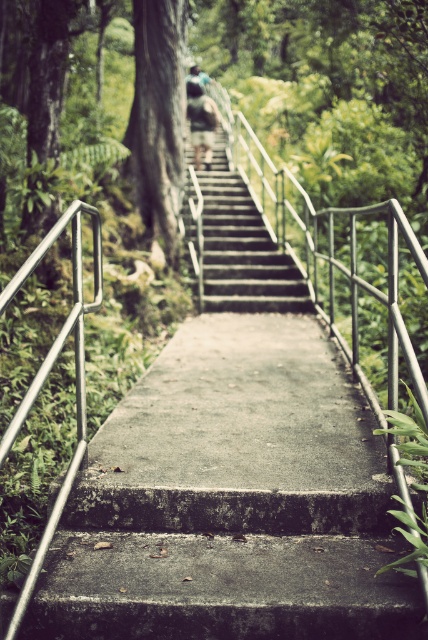
Question: Estimate the real-world distances between objects in this image. Which object is closer to the silver metallic handrail at left?

Choices:
 (A) green rough bark tree at center
 (B) green fabric shirt at upper center

Answer: (A)

Question: Which object is the closest to the silver metallic handrail at left?

Choices:
 (A) green rough bark tree at center
 (B) concrete/steps at center

Answer: (B)

Question: Does green rough bark tree at center lie in front of silver metallic handrail at left?

Choices:
 (A) yes
 (B) no

Answer: (B)

Question: Is green rough bark tree at center positioned before green fabric shirt at upper center?

Choices:
 (A) no
 (B) yes

Answer: (B)

Question: Is concrete/steps at center thinner than green fabric shirt at upper center?

Choices:
 (A) yes
 (B) no

Answer: (B)

Question: Which object is positioned farthest from the concrete/steps at center?

Choices:
 (A) green rough bark tree at center
 (B) silver metallic handrail at left

Answer: (B)